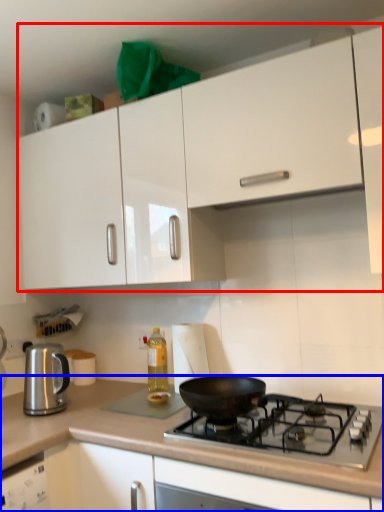
Question: Which object is closer to the camera taking this photo, cabinetry (highlighted by a red box) or countertop (highlighted by a blue box)?

Choices:
 (A) cabinetry
 (B) countertop

Answer: (B)